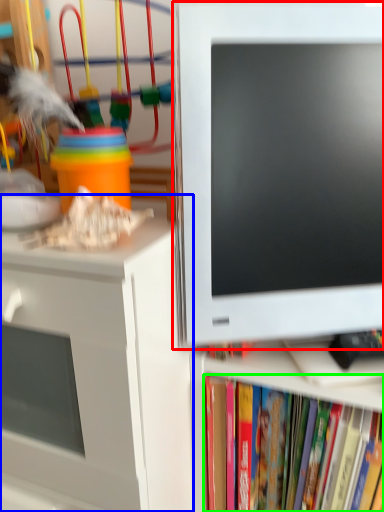
Question: Estimate the real-world distances between objects in this image. Which object is closer to computer monitor (highlighted by a red box), desk (highlighted by a blue box) or book (highlighted by a green box)?

Choices:
 (A) desk
 (B) book

Answer: (A)